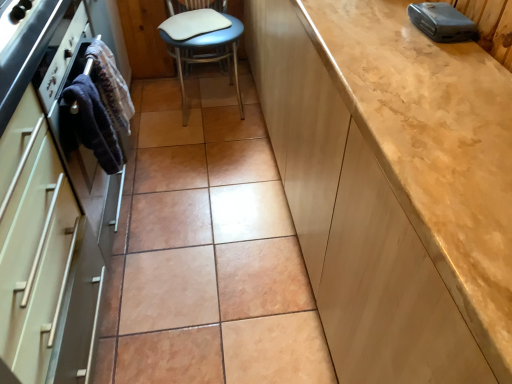
Question: Is matte beige cabinet at right, marked as the 2th cabinetry in a left-to-right arrangement, to the right of dark blue fabric towel at left, the 1th material when ordered from front to back, from the viewer's perspective?

Choices:
 (A) yes
 (B) no

Answer: (A)

Question: Does matte beige cabinet at right, marked as the 2th cabinetry in a left-to-right arrangement, have a smaller size compared to dark blue fabric towel at left, the 1th material when ordered from front to back?

Choices:
 (A) yes
 (B) no

Answer: (B)

Question: Is matte beige cabinet at right, marked as the first cabinetry in a right-to-left arrangement, wider than dark blue fabric towel at left, the 1th material when ordered from front to back?

Choices:
 (A) no
 (B) yes

Answer: (B)

Question: Is matte beige cabinet at right, marked as the 2th cabinetry in a left-to-right arrangement, not near dark blue fabric towel at left, the 2th material positioned from the back?

Choices:
 (A) no
 (B) yes

Answer: (A)

Question: Is matte beige cabinet at right, marked as the 2th cabinetry in a left-to-right arrangement, bigger than dark blue fabric towel at left, the 2th material positioned from the back?

Choices:
 (A) yes
 (B) no

Answer: (A)

Question: Is dark blue fabric towel at left, the 2th material positioned from the back, completely or partially inside matte beige cabinet at right, marked as the 2th cabinetry in a left-to-right arrangement?

Choices:
 (A) yes
 (B) no

Answer: (B)

Question: Could you tell me if dark blue fabric towel at left, the 1th material when ordered from front to back, is facing dark blue fabric at left, arranged as the 1th material when viewed from the back?

Choices:
 (A) no
 (B) yes

Answer: (A)

Question: Is dark blue fabric towel at left, the 1th material when ordered from front to back, positioned in front of dark blue fabric at left, arranged as the 1th material when viewed from the back?

Choices:
 (A) no
 (B) yes

Answer: (B)

Question: Would you say dark blue fabric at left, marked as the 2th material in a front-to-back arrangement, is part of dark blue fabric towel at left, the 2th material positioned from the back,'s contents?

Choices:
 (A) yes
 (B) no

Answer: (B)

Question: Is dark blue fabric towel at left, the 2th material positioned from the back, further to the viewer compared to dark blue fabric at left, arranged as the 1th material when viewed from the back?

Choices:
 (A) no
 (B) yes

Answer: (A)

Question: Is dark blue fabric towel at left, the 1th material when ordered from front to back, beside dark blue fabric at left, marked as the 2th material in a front-to-back arrangement?

Choices:
 (A) yes
 (B) no

Answer: (A)

Question: From the image's perspective, is dark blue fabric towel at left, the 2th material positioned from the back, on dark blue fabric at left, marked as the 2th material in a front-to-back arrangement?

Choices:
 (A) yes
 (B) no

Answer: (B)

Question: Does matte white oven at left, the second cabinetry viewed from the right, appear on the left side of white leather chair at center?

Choices:
 (A) no
 (B) yes

Answer: (B)